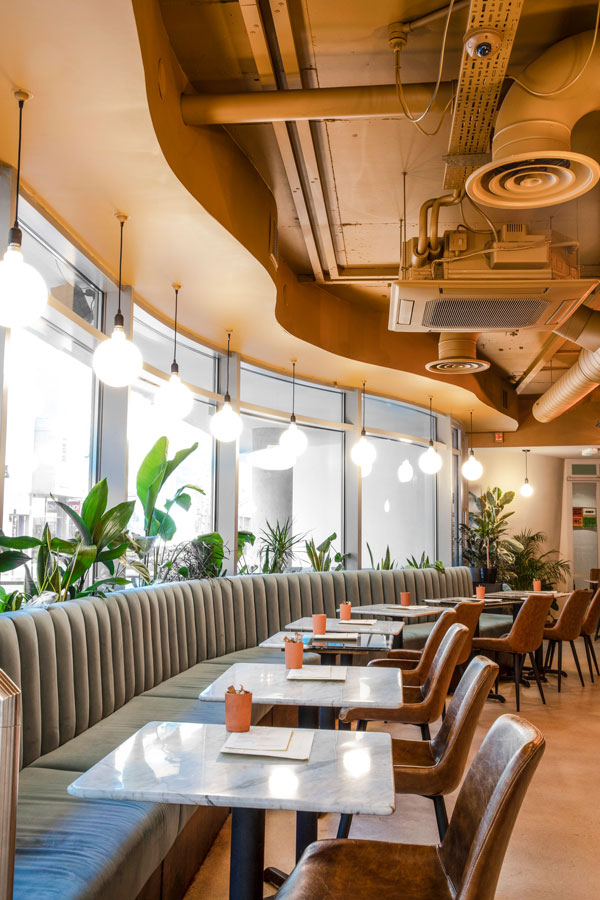
Locate an element on the screen. This screenshot has height=900, width=600. large round pipes on ceiling is located at coordinates (567, 392), (458, 346), (545, 117), (310, 106).